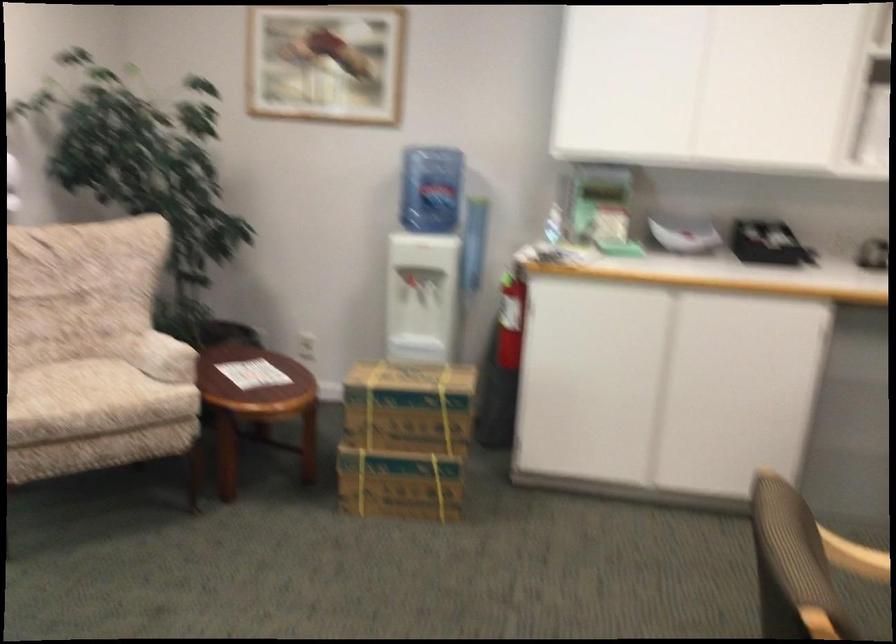
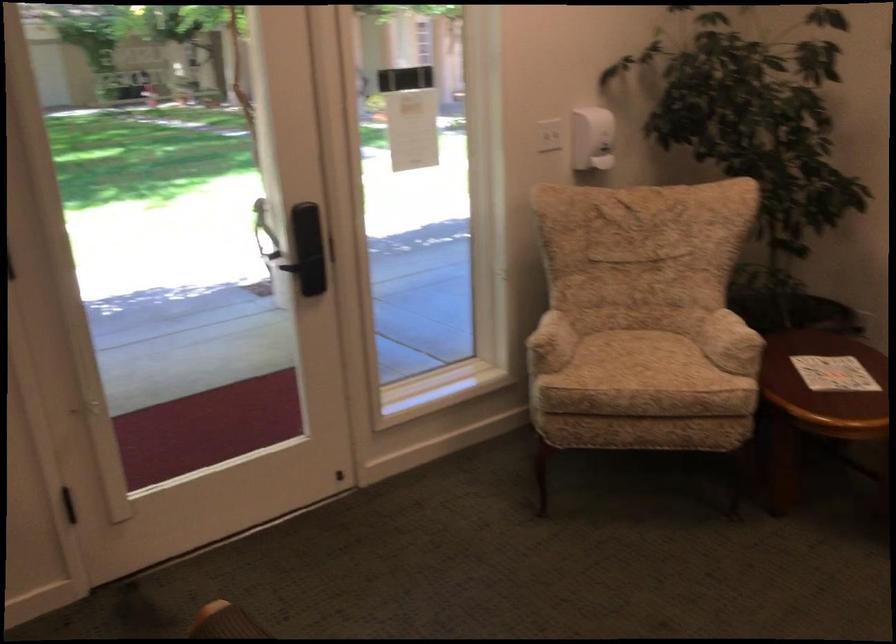
Where in the second image is the point corresponding to [73,375] from the first image?

(631, 346)